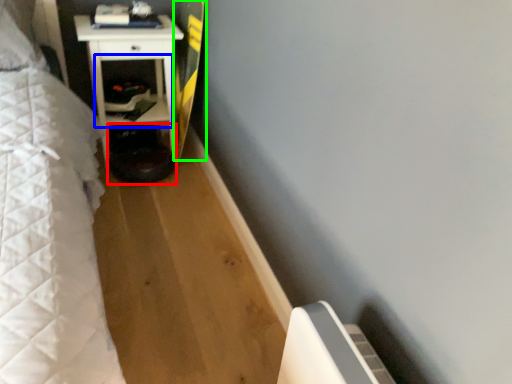
Question: Which object is the farthest from step stool (highlighted by a red box)? Choose among these: shelf (highlighted by a blue box) or longboard (highlighted by a green box).

Choices:
 (A) shelf
 (B) longboard

Answer: (B)